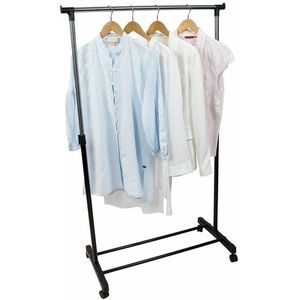
This screenshot has height=300, width=300. Identify the location of hangers. (110, 22), (135, 26), (162, 24), (190, 22).